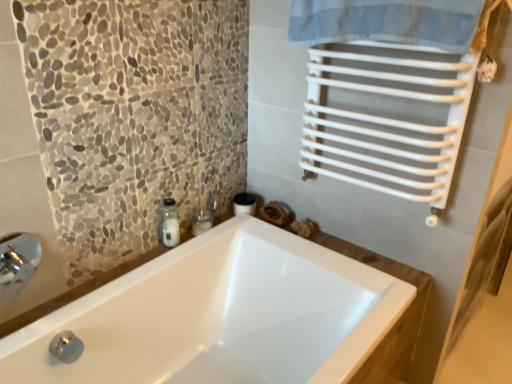
In order to click on free space in front of clear glass jar at upper left in this screenshot , I will do `click(159, 270)`.